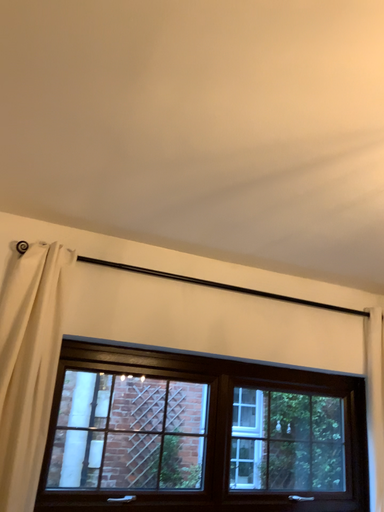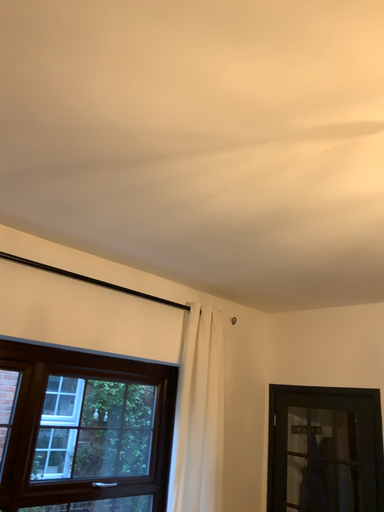
Question: How did the camera likely rotate when shooting the video?

Choices:
 (A) rotated left
 (B) rotated right

Answer: (B)